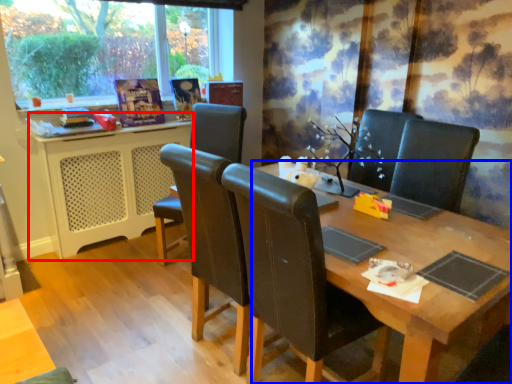
Question: Which of the following is the closest to the observer, computer desk (highlighted by a red box) or table (highlighted by a blue box)?

Choices:
 (A) computer desk
 (B) table

Answer: (B)